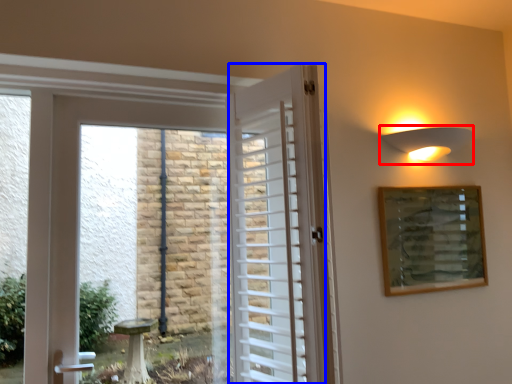
Question: Which object is further to the camera taking this photo, light fixture (highlighted by a red box) or door (highlighted by a blue box)?

Choices:
 (A) light fixture
 (B) door

Answer: (A)